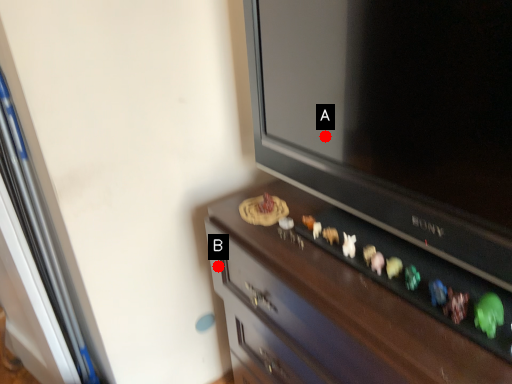
Question: Two points are circled on the image, labeled by A and B beside each circle. Which point is farther from the camera taking this photo?

Choices:
 (A) A is further
 (B) B is further

Answer: (B)